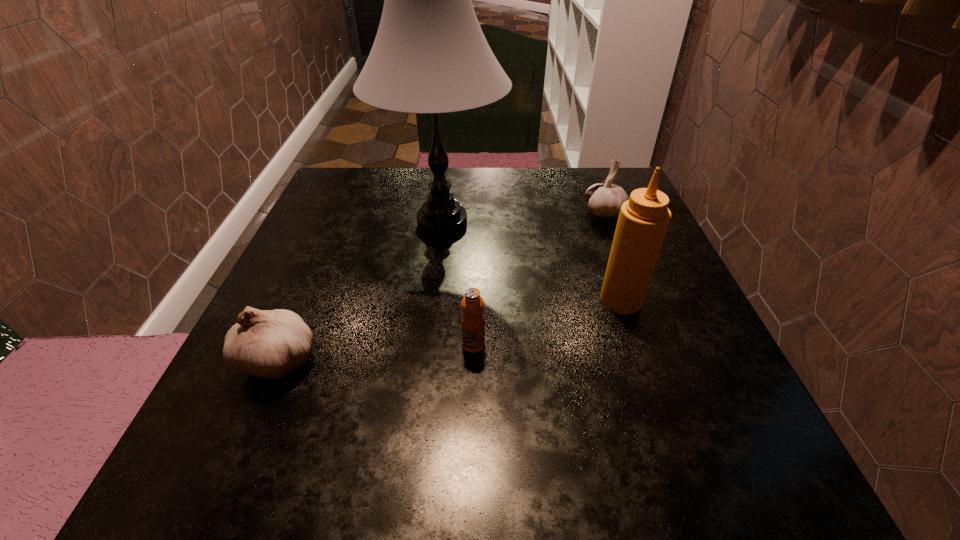
Identify the location of unoccupied area between the third farthest object and the nearer garlic. (450, 329).

Identify the location of vacant point located between the lamp and the nearer garlic. The image size is (960, 540). (360, 291).

In order to click on free area in between the nearer garlic and the third farthest object in this screenshot , I will do `click(450, 329)`.

Where is `vacant space in between the lamp and the right garlic`? vacant space in between the lamp and the right garlic is located at coordinates (523, 218).

The image size is (960, 540). In order to click on vacant area that lies between the fourth shortest object and the leftmost object in this screenshot , I will do `click(450, 329)`.

At what (x,y) coordinates should I click in order to perform the action: click on object that is the third closest to the orange juice. Please return your answer as a coordinate pair (x, y). The image size is (960, 540). Looking at the image, I should click on (269, 344).

In order to click on the closest object to the nearer garlic in this screenshot , I will do `click(430, 56)`.